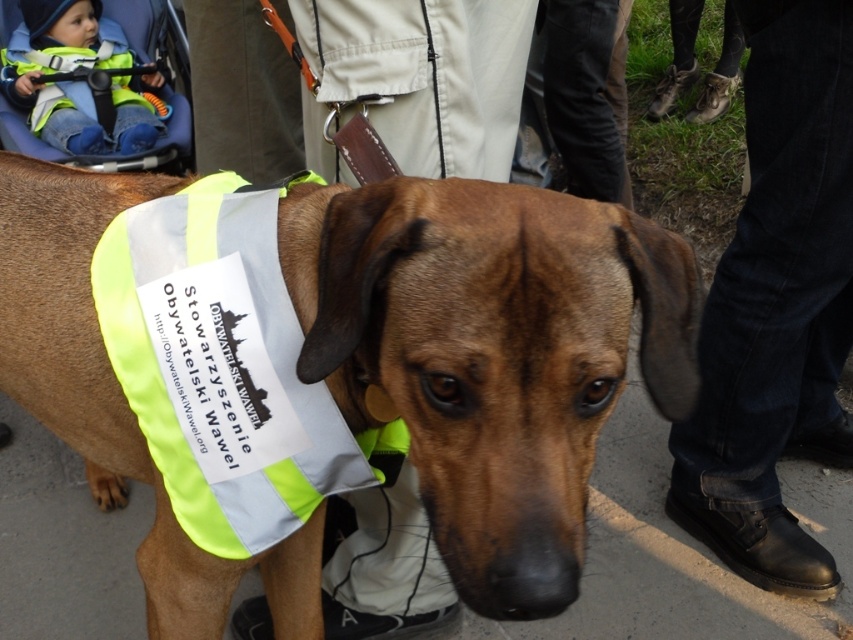
Question: Is the position of jeans at lower right more distant than that of matte green vest at upper left?

Choices:
 (A) no
 (B) yes

Answer: (A)

Question: Is neon yellow fabric safety vest at center further to camera compared to matte green vest at upper left?

Choices:
 (A) yes
 (B) no

Answer: (B)

Question: Considering the relative positions of neon yellow vest at center and matte green vest at upper left in the image provided, where is neon yellow vest at center located with respect to matte green vest at upper left?

Choices:
 (A) above
 (B) below

Answer: (B)

Question: Which point appears closest to the camera in this image?

Choices:
 (A) (119, 60)
 (B) (817, 243)

Answer: (B)

Question: Which point is farther to the camera?

Choices:
 (A) (252, 353)
 (B) (108, 45)

Answer: (B)

Question: Among these objects, which one is farthest from the camera?

Choices:
 (A) neon yellow fabric safety vest at center
 (B) jeans at lower right
 (C) matte green vest at upper left
 (D) neon yellow vest at center

Answer: (C)